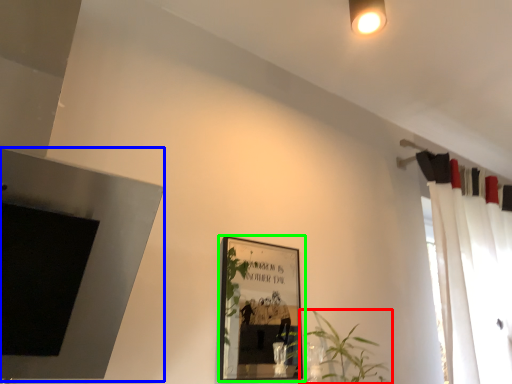
Question: Estimate the real-world distances between objects in this image. Which object is farther from houseplant (highlighted by a red box), fireplace (highlighted by a blue box) or picture frame (highlighted by a green box)?

Choices:
 (A) fireplace
 (B) picture frame

Answer: (B)